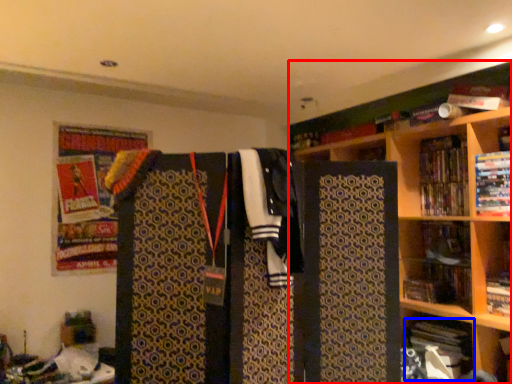
Question: Which object appears farthest to the camera in this image, bookcase (highlighted by a red box) or book (highlighted by a blue box)?

Choices:
 (A) bookcase
 (B) book

Answer: (B)